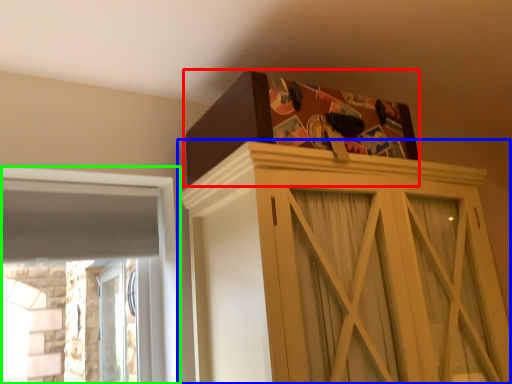
Question: Based on their relative distances, which object is nearer to cardboard box (highlighted by a red box)? Choose from cupboard (highlighted by a blue box) and window (highlighted by a green box).

Choices:
 (A) cupboard
 (B) window

Answer: (A)